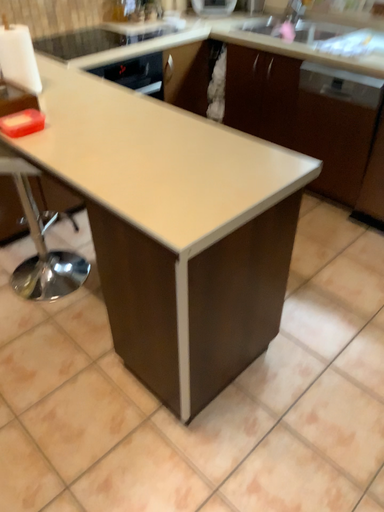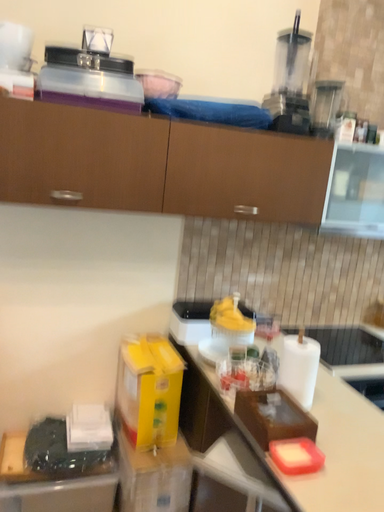
Question: Which way did the camera rotate in the video?

Choices:
 (A) rotated upward
 (B) rotated downward

Answer: (A)